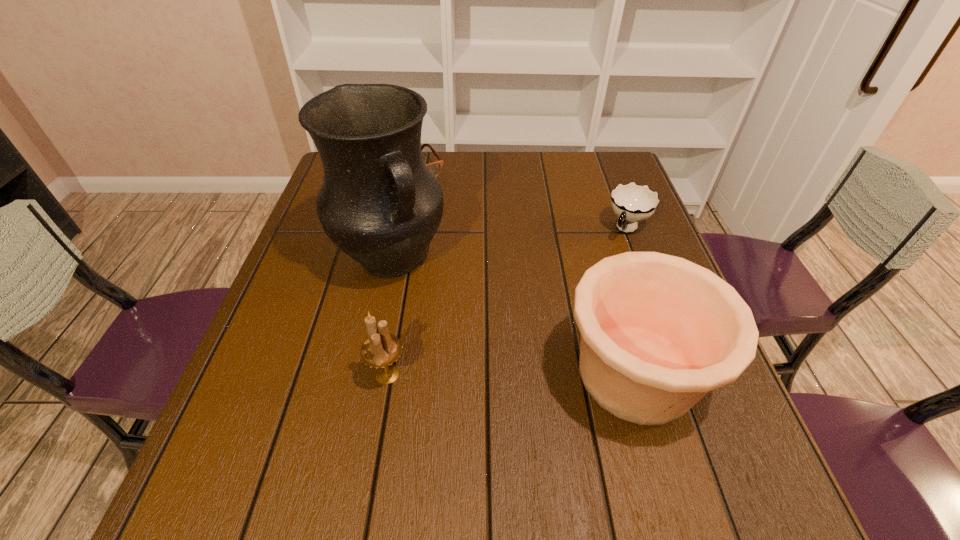
This screenshot has height=540, width=960. I want to click on free space located on the front-facing side of the farthest object, so click(x=473, y=276).

This screenshot has height=540, width=960. I want to click on vacant area situated 0.320m on the side of the cup with the handle, so click(x=564, y=325).

Where is `vacant area situated 0.360m on the side of the cup with the handle`? This screenshot has height=540, width=960. vacant area situated 0.360m on the side of the cup with the handle is located at coordinates (556, 337).

Find the location of `vacant space located 0.300m on the side of the cup with the handle`. vacant space located 0.300m on the side of the cup with the handle is located at coordinates (568, 319).

This screenshot has width=960, height=540. I want to click on blank space located on the handle side of the pitcher, so click(x=472, y=363).

Locate an element on the screen. vacant position located 0.090m on the handle side of the pitcher is located at coordinates (437, 317).

At what (x,y) coordinates should I click in order to perform the action: click on free space located on the handle side of the pitcher. Please return your answer as a coordinate pair (x, y). The width and height of the screenshot is (960, 540). Looking at the image, I should click on 511,415.

Identify the location of object at the far edge. The height and width of the screenshot is (540, 960). coord(435,167).

Find the location of `object that is at the near edge`. object that is at the near edge is located at coordinates (658, 332).

Where is `spectacles at the left edge`? spectacles at the left edge is located at coordinates (435, 167).